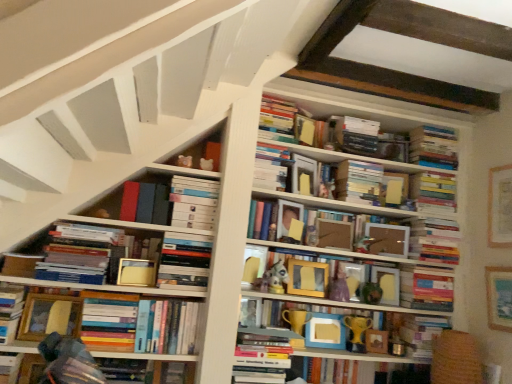
Question: Can you confirm if hardcover books at upper right, acting as the thirteenth book starting from the bottom, is thinner than wooden frame at center, arranged as the ninth book when viewed from the top?

Choices:
 (A) yes
 (B) no

Answer: (B)

Question: Can you confirm if hardcover books at upper right, acting as the thirteenth book starting from the bottom, is smaller than wooden frame at center, arranged as the ninth book when viewed from the top?

Choices:
 (A) no
 (B) yes

Answer: (B)

Question: Considering the relative sizes of hardcover books at upper right, the fourth book from the top, and wooden frame at center, the eighth book from the bottom, in the image provided, is hardcover books at upper right, the fourth book from the top, taller than wooden frame at center, the eighth book from the bottom,?

Choices:
 (A) no
 (B) yes

Answer: (A)

Question: Does hardcover books at upper right, acting as the thirteenth book starting from the bottom, lie behind wooden frame at center, arranged as the ninth book when viewed from the top?

Choices:
 (A) yes
 (B) no

Answer: (A)

Question: Considering the relative sizes of hardcover books at upper right, acting as the thirteenth book starting from the bottom, and wooden frame at center, the eighth book from the bottom, in the image provided, is hardcover books at upper right, acting as the thirteenth book starting from the bottom, bigger than wooden frame at center, the eighth book from the bottom,?

Choices:
 (A) no
 (B) yes

Answer: (A)

Question: Is white matte bookshelf at center, acting as the 14th book starting from the bottom, wider or thinner than hardcover book at center, the second paperback book in the left-to-right sequence?

Choices:
 (A) thin
 (B) wide

Answer: (B)

Question: In the image, is white matte bookshelf at center, acting as the 14th book starting from the bottom, positioned in front of or behind hardcover book at center, which ranks as the 4th paperback book in right-to-left order?

Choices:
 (A) front
 (B) behind

Answer: (A)

Question: In terms of size, does white matte bookshelf at center, the 3th book viewed from the top, appear bigger or smaller than hardcover book at center, the second paperback book in the front-to-back sequence?

Choices:
 (A) big
 (B) small

Answer: (A)

Question: From a real-world perspective, is white matte bookshelf at center, the 3th book viewed from the top, positioned above or below hardcover book at center, the second paperback book in the front-to-back sequence?

Choices:
 (A) below
 (B) above

Answer: (B)

Question: Is point (443, 175) positioned closer to the camera than point (380, 332)?

Choices:
 (A) closer
 (B) farther

Answer: (B)

Question: Considering the relative positions of hardcover books at upper right, the fourth book from the top, and wooden picture frame at center, arranged as the 3th picture frame when viewed from the left, in the image provided, is hardcover books at upper right, the fourth book from the top, to the left or to the right of wooden picture frame at center, arranged as the 3th picture frame when viewed from the left,?

Choices:
 (A) left
 (B) right

Answer: (B)

Question: In the image, is hardcover books at upper right, the fourth book from the top, positioned in front of or behind wooden picture frame at center, which appears as the 3th picture frame when viewed from the right?

Choices:
 (A) behind
 (B) front

Answer: (A)

Question: Is hardcover books at upper right, acting as the thirteenth book starting from the bottom, bigger or smaller than wooden picture frame at center, arranged as the 3th picture frame when viewed from the left?

Choices:
 (A) big
 (B) small

Answer: (A)

Question: Considering the positions of matte gold trophy at center, which appears as the 5th book when ordered from the bottom, and wooden picture frame at center, positioned as the fourth picture frame in right-to-left order, in the image, is matte gold trophy at center, which appears as the 5th book when ordered from the bottom, bigger or smaller than wooden picture frame at center, positioned as the fourth picture frame in right-to-left order,?

Choices:
 (A) small
 (B) big

Answer: (B)

Question: From the image's perspective, is matte gold trophy at center, which appears as the 5th book when ordered from the bottom, positioned above or below wooden picture frame at center, positioned as the fourth picture frame in right-to-left order?

Choices:
 (A) above
 (B) below

Answer: (B)